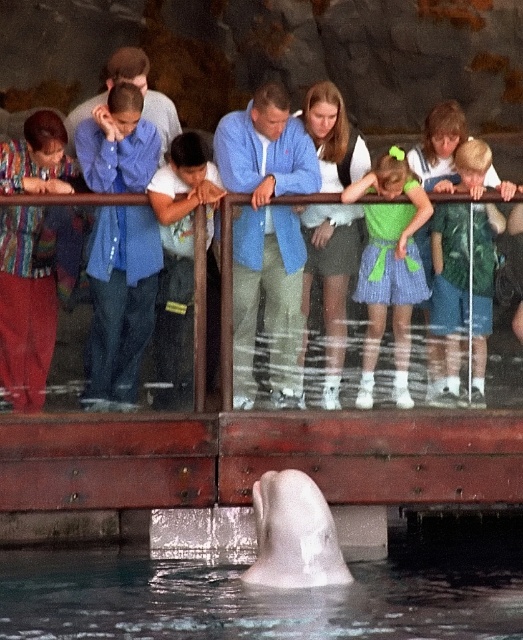
Question: Does green textured dress at center have a smaller size compared to white smooth dolphin at lower center?

Choices:
 (A) no
 (B) yes

Answer: (A)

Question: Which point is closer to the camera?

Choices:
 (A) (293, 579)
 (B) (1, 573)
 (C) (233, 240)

Answer: (A)

Question: Which point is closer to the camera?

Choices:
 (A) (292, 189)
 (B) (463, 218)
 (C) (266, 502)
 (D) (392, 224)

Answer: (C)

Question: Can you confirm if clear water at dolphin center is positioned below white smooth dolphin at lower center?

Choices:
 (A) yes
 (B) no

Answer: (A)

Question: Which of the following is the farthest from the observer?

Choices:
 (A) (270, 541)
 (B) (471, 632)

Answer: (B)

Question: Does green textured dress at center appear on the right side of white smooth dolphin at lower center?

Choices:
 (A) yes
 (B) no

Answer: (A)